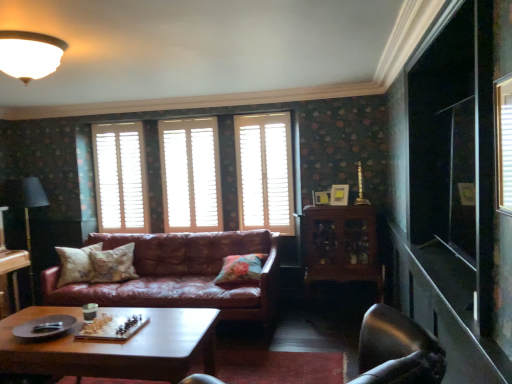
Find the location of a particular element. vacant space in front of matte white picture frame at center, the first picture frame positioned from the left is located at coordinates (326, 210).